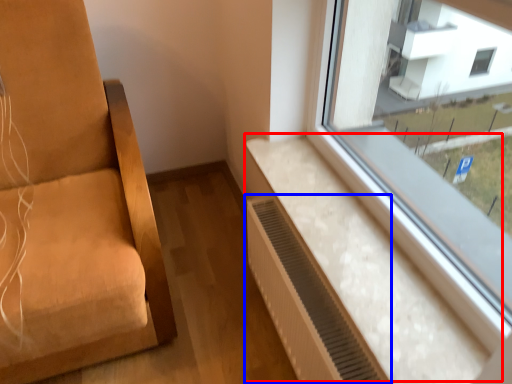
Question: Which of the following is the closest to the observer, window sill (highlighted by a red box) or air conditioner (highlighted by a blue box)?

Choices:
 (A) window sill
 (B) air conditioner

Answer: (A)